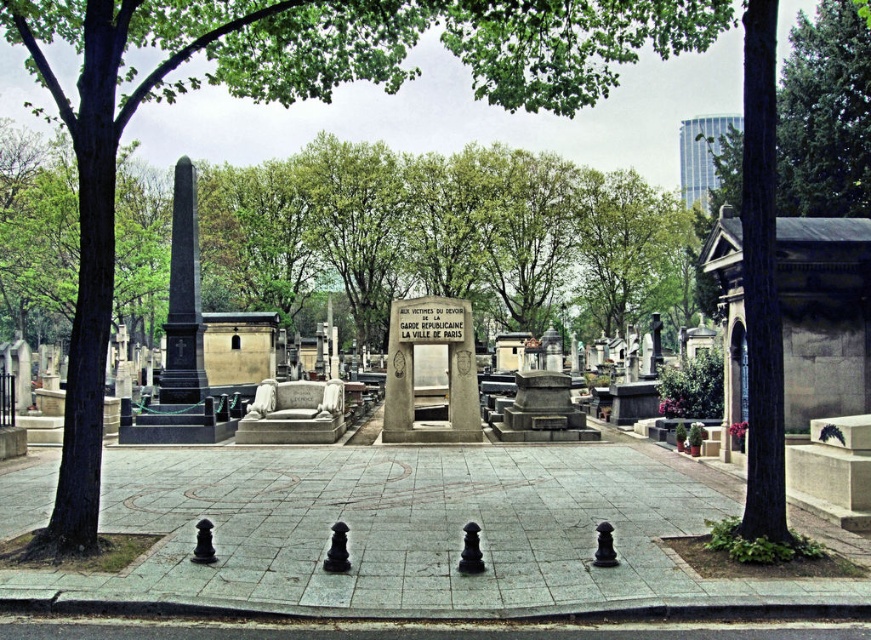
You are standing at the point marked by the coordinates point [289,104] in the cemetery scene. What object are you directly at?

The point [289,104] marks the green leafy tree at center, so you are directly at the green leafy tree at center.

You are a visitor to the cemetery and want to take a photo of the polished stone monument at center without the green leafy tree at upper center blocking the view. Is it possible to position yourself in a way that the monument is fully visible while the tree is out of frame?

The green leafy tree at upper center is bigger than the polished stone monument at center, so if you position yourself far enough away from the tree, you can frame the shot so the monument is fully visible while the tree is out of the frame.